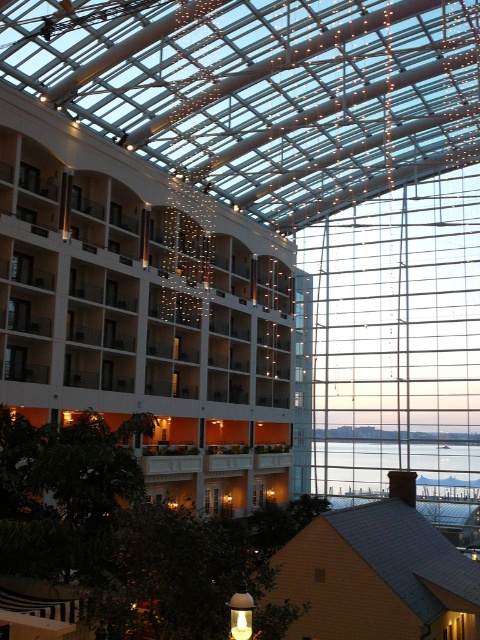
You are a visitor standing at the entrance of the modern building. You notice the yellow shingled roof at lower right and the transparent glass water at center. Which object appears larger in the image?

The yellow shingled roof at lower right is bigger than transparent glass water at center, so it appears larger in the image.

You are standing in the modern building and want to take a photo of the white glossy hotel at center and the transparent glass water at center. Which object should you focus on first to ensure both are in focus?

You should focus on the white glossy hotel at center first because it is closer to you than the transparent glass glass water at center, so adjusting focus from near to far will help both be in focus.